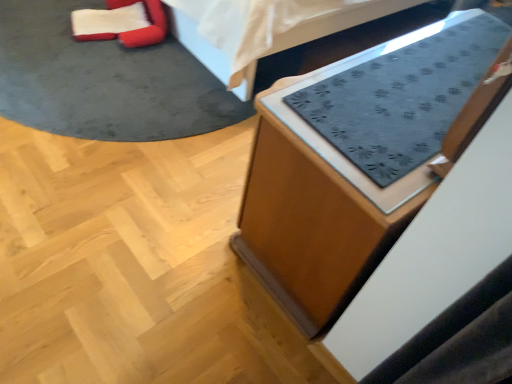
What are the coordinates of `vacant space positioned to the left of velvet red bean bag chair at upper left` in the screenshot? It's located at (34, 23).